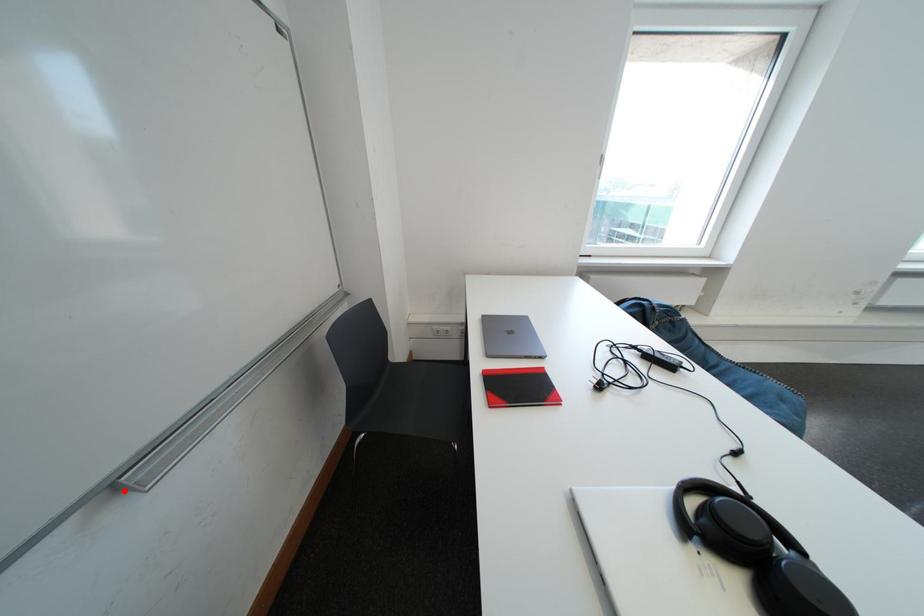
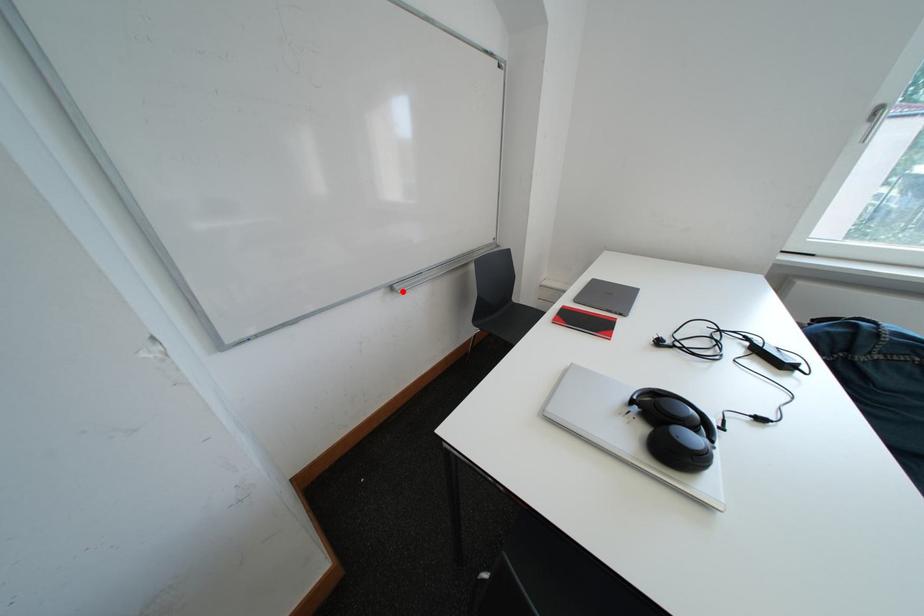
I am providing you with two images of the same scene from different viewpoints. A red point is marked on the first image and another point is marked on the second image. Does the point marked in image1 correspond to the same location as the one in image2?

Yes